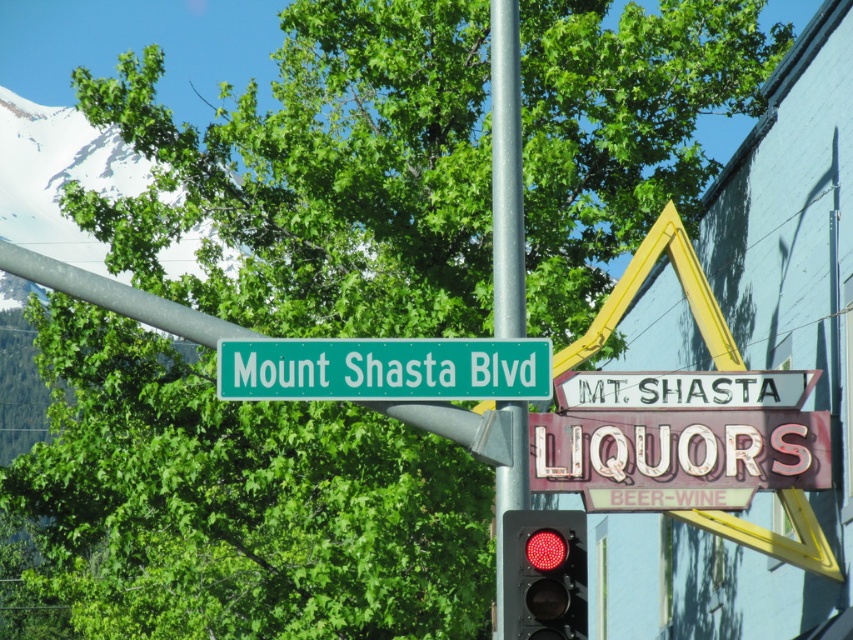
You are standing on the sidewalk and want to take a photo of the green metallic street sign at upper center. Which direction should you face to ensure the sign is in the center of your camera view?

The green metallic street sign at upper center is located at point (x=384, y=369), so you should face towards the upper center direction to center it in your camera view.

You are driving a car and see the green metallic street sign at upper center and the red glass traffic light at center. Which object is closer to you?

The green metallic street sign at upper center is closer to you because the red glass traffic light at center is behind it.